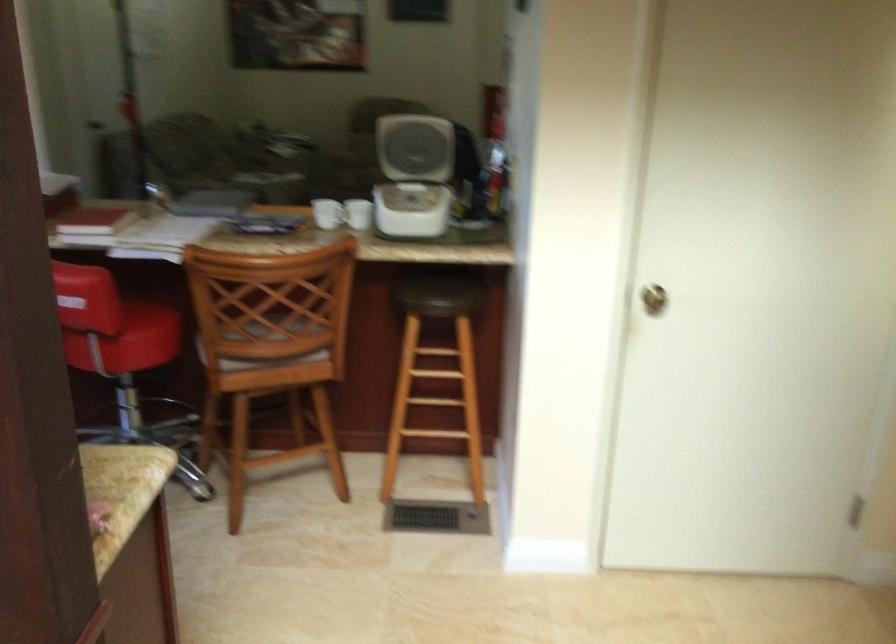
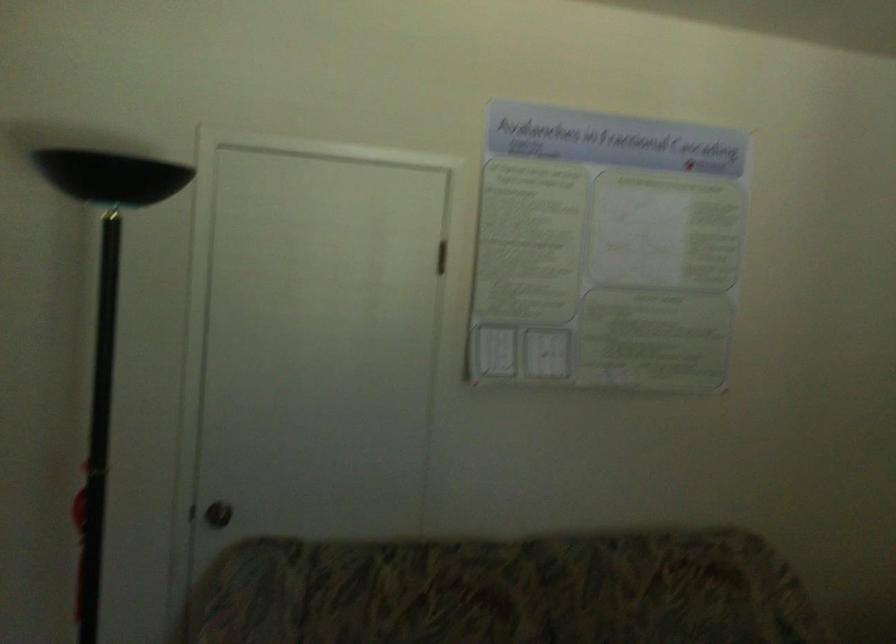
In the second image, find the point that corresponds to [100,102] in the first image.

(218, 514)